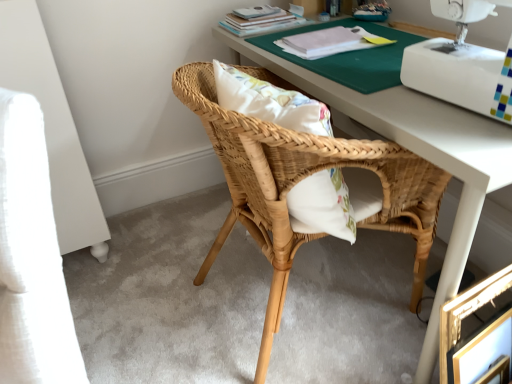
Locate an element on the screen. Image resolution: width=512 pixels, height=384 pixels. vacant point to the left of white plastic sewing machine at upper right is located at coordinates (388, 97).